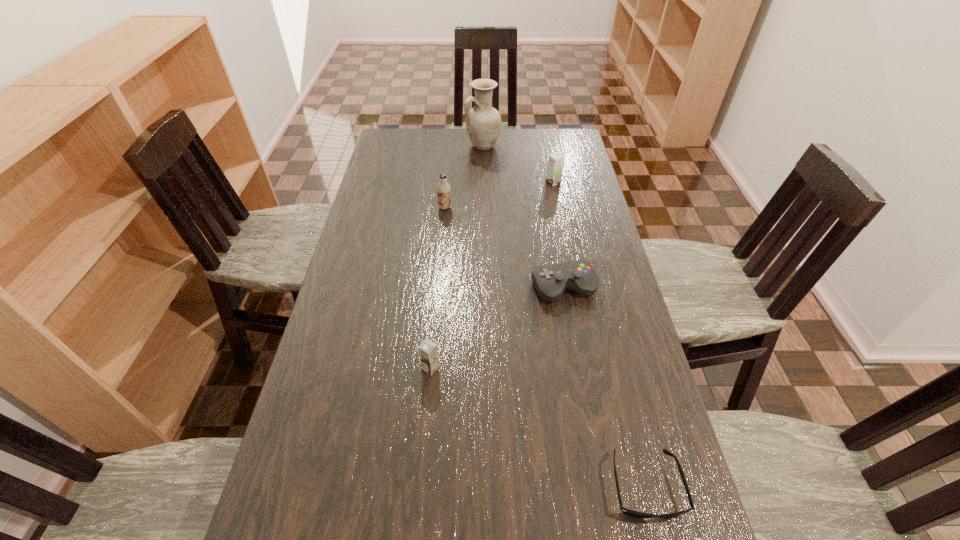
Identify the location of sunglasses. (625, 511).

Where is `vacant space located 0.060m on the front of the tallest object`? This screenshot has width=960, height=540. vacant space located 0.060m on the front of the tallest object is located at coordinates point(483,163).

Identify the location of free space located on the right of the second nearest chocolate milk. (565, 207).

You are a GUI agent. You are given a task and a screenshot of the screen. Output one action in this format:
    pyautogui.click(x=<x>, y=<y>)
    Task: Click on the free location located 0.110m on the front of the farthest chocolate milk
    The height and width of the screenshot is (540, 960).
    Given the screenshot: What is the action you would take?
    pyautogui.click(x=558, y=205)

The image size is (960, 540). In order to click on free spot located on the front of the third shortest object in this screenshot , I will do `click(422, 462)`.

In order to click on vacant area located 0.120m on the back of the control in this screenshot , I will do `click(556, 244)`.

Locate an element on the screen. This screenshot has width=960, height=540. object at the far edge is located at coordinates (483, 122).

Locate an element on the screen. Image resolution: width=960 pixels, height=540 pixels. chocolate milk at the right edge is located at coordinates (556, 160).

This screenshot has width=960, height=540. I want to click on control located at the right edge, so click(x=550, y=281).

What are the coordinates of `sunglasses that is positioned at the right edge` in the screenshot? It's located at (625, 511).